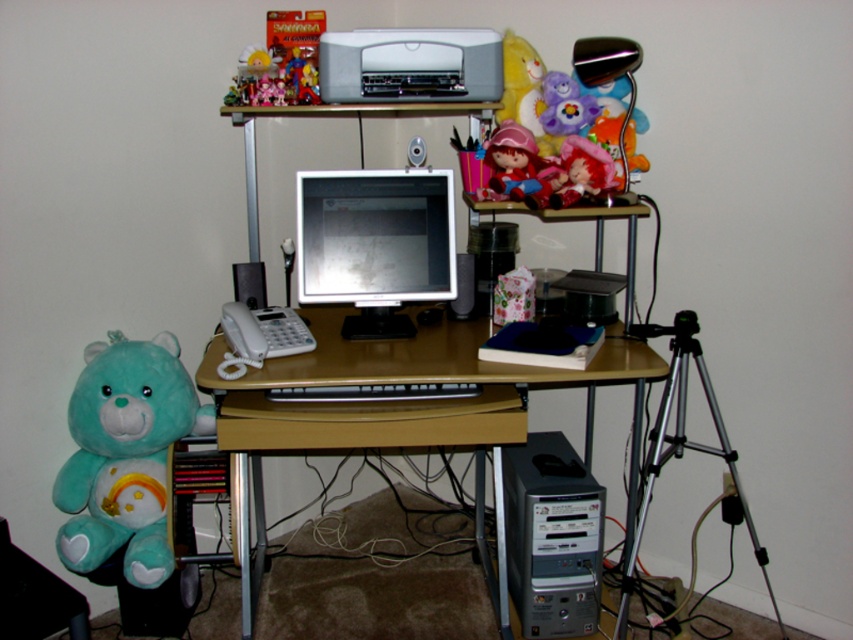
You are setting up a camera in this home office. You have a silver metallic tripod at lower right and a matte plastic doll at center. Which object can support a camera better based on their sizes?

The silver metallic tripod at lower right is bigger than the matte plastic doll at center, so it can support a camera better.

You are setting up a new desk lamp that needs to be placed on the desk. The lamp requires at least 15 cm of space. Considering the matte silver monitor at center and the silver metallic desktop tower at lower center, which one can you place the lamp next to without moving?

The matte silver monitor at center has a smaller size compared to the silver metallic desktop tower at lower center, so placing the lamp next to the matte silver monitor at center would provide more space for the lamp.